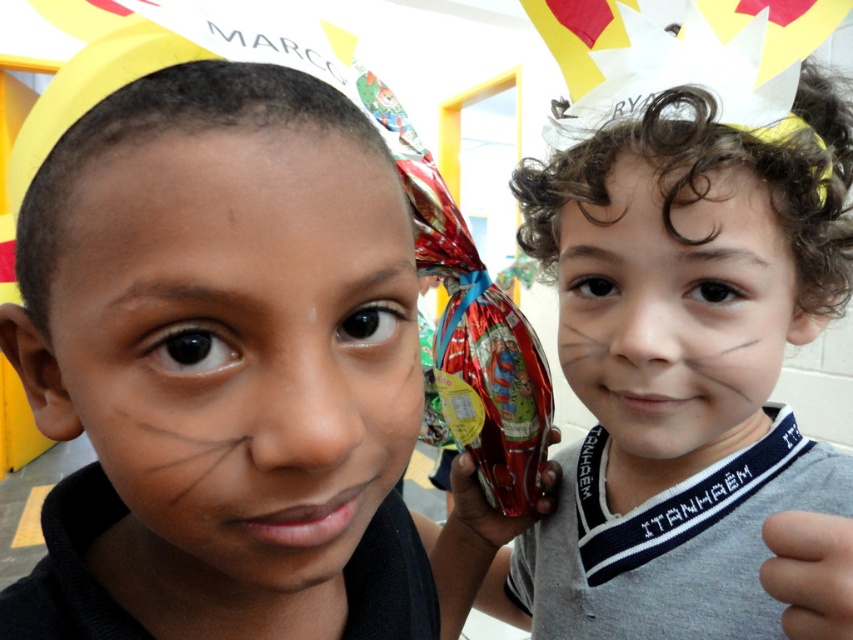
You are a photographer trying to focus on both the smooth skin face at right and the skinny flesh at lower right. Which one should you adjust your camera to focus on first?

You should focus on the smooth skin face at right first because it is closer to the viewer than the skinny flesh at lower right.

Based on the scene description, where is the smooth skin face at right located in relation to the point marked at coordinates [675,316]?

The smooth skin face at right is exactly at the point marked at coordinates [675,316].

You are a photographer at a costume party and see the matte gray shirt at center and the matte black face at left. Which object is positioned to the right of the other?

The matte gray shirt at center is to the right of the matte black face at left according to the description.